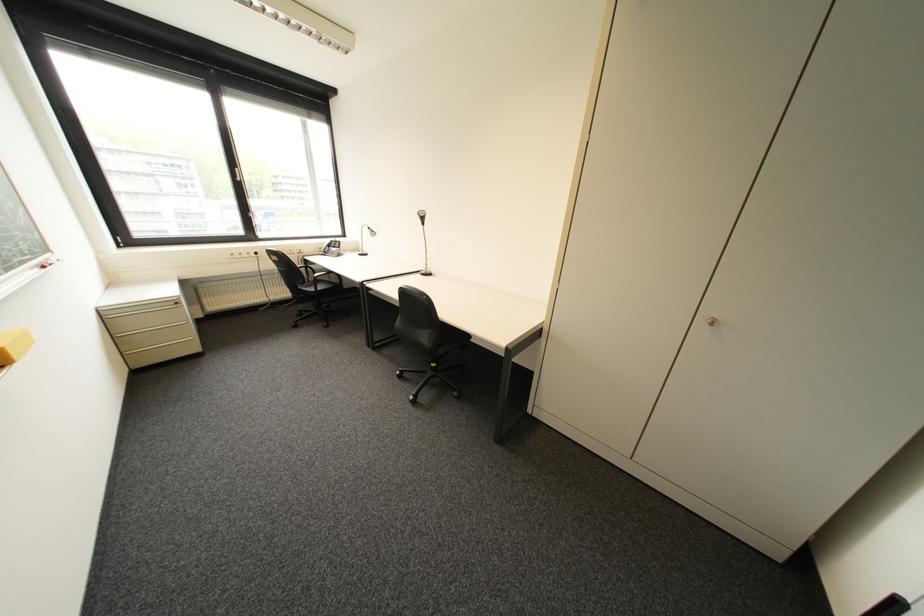
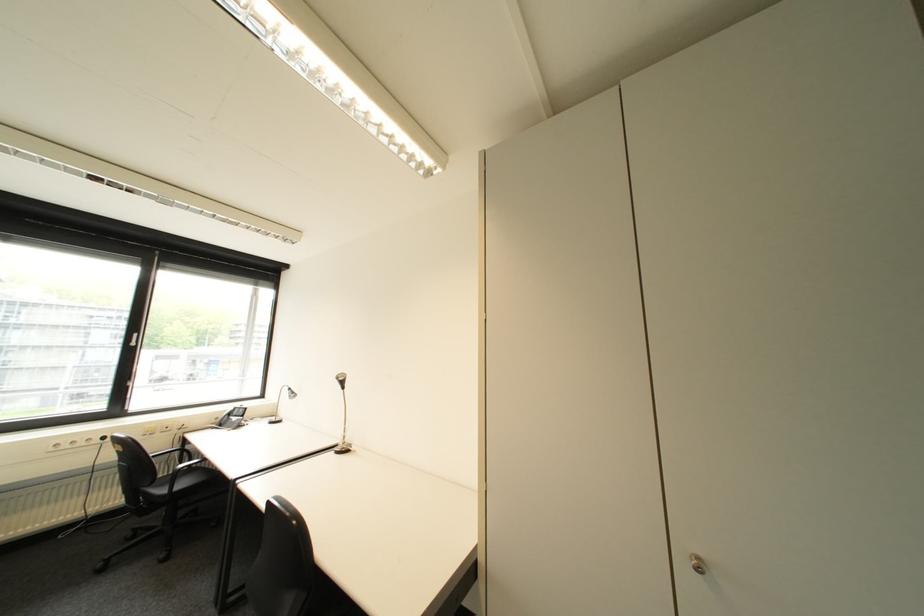
Find the pixel in the second image that matches point 329,290 in the first image.

(187, 488)